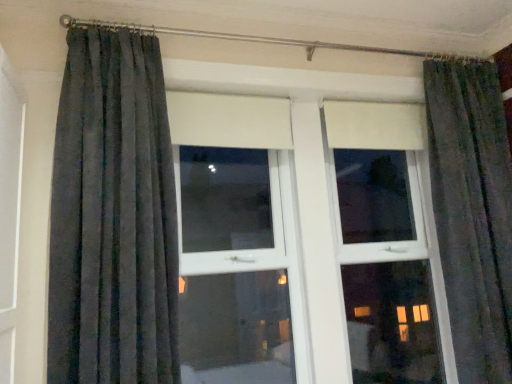
Question: From the image's perspective, is matte gray curtains at center under dark grey textured curtain at left?

Choices:
 (A) yes
 (B) no

Answer: (A)

Question: Is matte gray curtains at center turned away from dark grey textured curtain at left?

Choices:
 (A) no
 (B) yes

Answer: (A)

Question: Is matte gray curtains at center thinner than dark grey textured curtain at left?

Choices:
 (A) no
 (B) yes

Answer: (A)

Question: Can you confirm if matte gray curtains at center is shorter than dark grey textured curtain at left?

Choices:
 (A) yes
 (B) no

Answer: (B)

Question: Is matte gray curtains at center touching dark grey textured curtain at left?

Choices:
 (A) no
 (B) yes

Answer: (A)

Question: Is matte gray curtains at center positioned before dark grey textured curtain at left?

Choices:
 (A) yes
 (B) no

Answer: (B)

Question: From a real-world perspective, does dark grey textured curtain at left stand above matte gray curtains at center?

Choices:
 (A) yes
 (B) no

Answer: (A)

Question: Would you consider dark grey textured curtain at left to be distant from matte gray curtains at center?

Choices:
 (A) yes
 (B) no

Answer: (B)

Question: Can you confirm if dark grey textured curtain at left is smaller than matte gray curtains at center?

Choices:
 (A) no
 (B) yes

Answer: (B)

Question: Can you confirm if dark grey textured curtain at left is thinner than matte gray curtains at center?

Choices:
 (A) no
 (B) yes

Answer: (B)

Question: Is dark grey textured curtain at left turned away from matte gray curtains at center?

Choices:
 (A) yes
 (B) no

Answer: (B)

Question: From a real-world perspective, does dark grey textured curtain at left sit lower than matte gray curtains at center?

Choices:
 (A) no
 (B) yes

Answer: (A)

Question: Considering the positions of point (93, 192) and point (264, 253), is point (93, 192) closer or farther from the camera than point (264, 253)?

Choices:
 (A) farther
 (B) closer

Answer: (B)